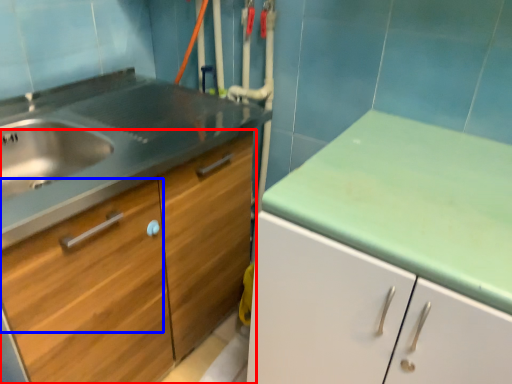
Question: Among these objects, which one is nearest to the camera, cabinetry (highlighted by a red box) or drawer (highlighted by a blue box)?

Choices:
 (A) cabinetry
 (B) drawer

Answer: (B)